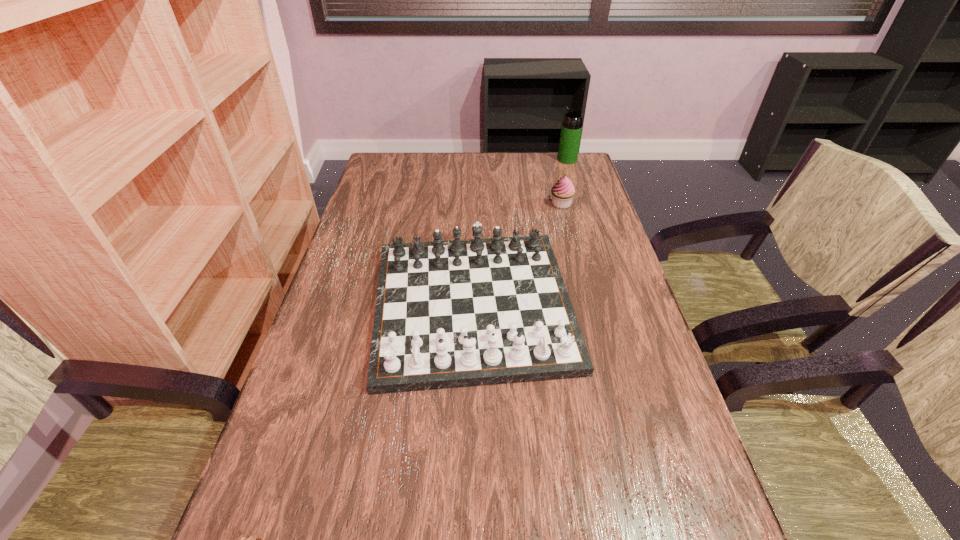
You are a GUI agent. You are given a task and a screenshot of the screen. Output one action in this format:
    pyautogui.click(x=<x>, y=<y>)
    Task: Click on the object located in the left edge section of the desktop
    
    Given the screenshot: What is the action you would take?
    pyautogui.click(x=460, y=313)

Locate an element on the screen. The height and width of the screenshot is (540, 960). thermos bottle that is at the right edge is located at coordinates (571, 128).

Image resolution: width=960 pixels, height=540 pixels. Identify the location of chessboard that is at the right edge. (460, 313).

The image size is (960, 540). In order to click on cupcake at the right edge in this screenshot , I will do `click(563, 191)`.

Locate an element on the screen. object at the far right corner is located at coordinates (571, 128).

I want to click on vacant area at the far edge, so 515,169.

This screenshot has width=960, height=540. Identify the location of vacant space at the left edge of the desktop. (292, 396).

The image size is (960, 540). I want to click on free point at the right edge, so click(598, 238).

In order to click on blank space at the far left corner in this screenshot , I will do `click(395, 168)`.

The image size is (960, 540). I want to click on vacant space at the far right corner, so click(558, 177).